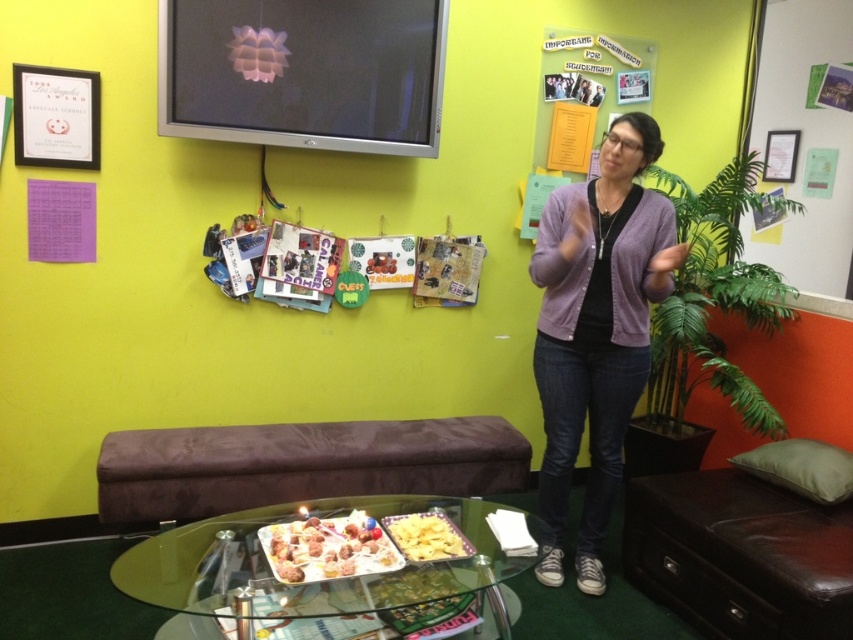
Question: Does brown leather couch at lower right appear under yellow matte chips at center?

Choices:
 (A) yes
 (B) no

Answer: (A)

Question: Does transparent glass table at lower center appear on the left side of yellow matte chips at center?

Choices:
 (A) yes
 (B) no

Answer: (A)

Question: Which of the following is the farthest from the observer?

Choices:
 (A) brown leather couch at lower right
 (B) purple knit cardigan at center

Answer: (B)

Question: Which object is the closest to the brown suede bench at lower center?

Choices:
 (A) shiny metallic tray at lower center
 (B) yellow matte chips at center

Answer: (A)

Question: Which object is closer to the camera taking this photo?

Choices:
 (A) brown suede bench at lower center
 (B) transparent glass table at lower center
 (C) brown leather couch at lower right
 (D) purple knit cardigan at center

Answer: (B)

Question: Is purple knit cardigan at center below brown suede bench at lower center?

Choices:
 (A) no
 (B) yes

Answer: (A)